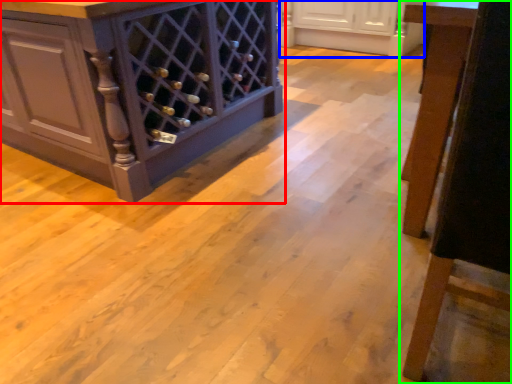
Question: Which is farther away from cabinetry (highlighted by a red box)? cabinetry (highlighted by a blue box) or furniture (highlighted by a green box)?

Choices:
 (A) cabinetry
 (B) furniture

Answer: (A)